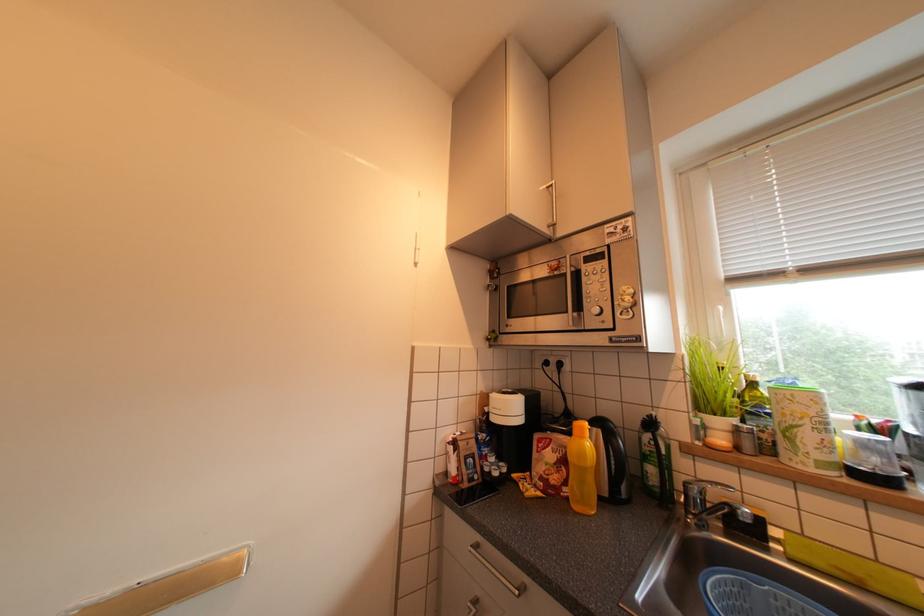
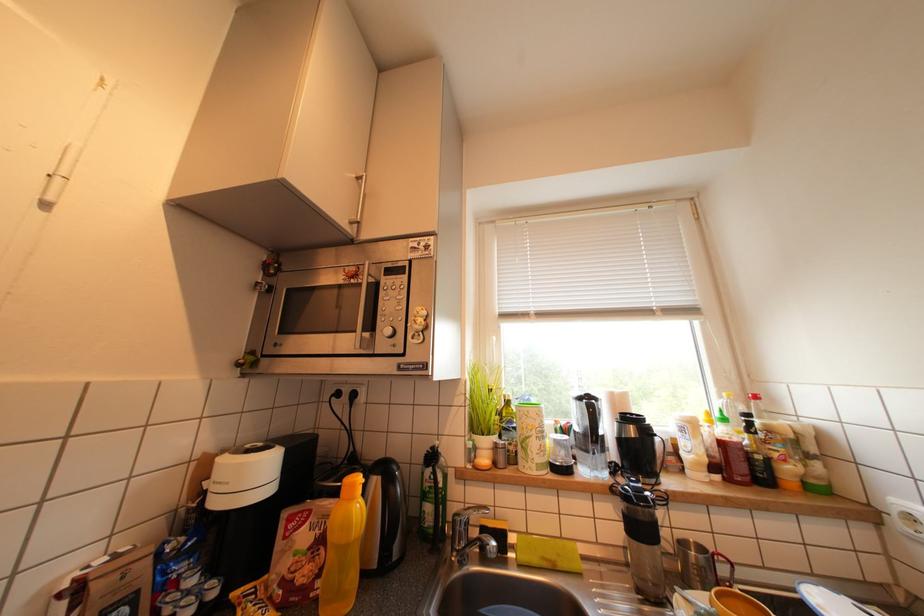
Question: The camera is either moving clockwise (left) or counter-clockwise (right) around the object. The first image is from the beginning of the video and the second image is from the end. Is the camera moving left or right when shooting the video?

Choices:
 (A) Left
 (B) Right

Answer: (A)